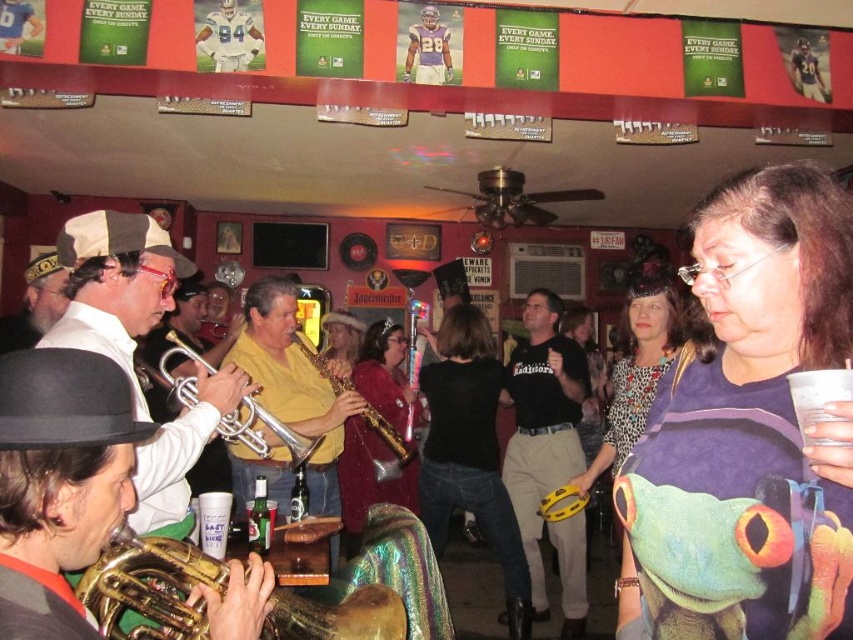
You are a photographer standing at the back of the room. You want to take a photo of the matte gold trumpet at left and the matte yellow shirt at center so that both are in focus. Given that your camera has a depth of field that can cover objects within a 3 meter range, will both subjects be in focus?

The matte gold trumpet at left is 3.52 meters away from the matte yellow shirt at center. Since the distance between them exceeds the camera sensor depth of field range of 3 meters, it is unlikely both will be in focus in a single shot.

You are a photographer trying to capture a clear shot of the purple printed shirt at center and the silver metallic trumpet at center. Since you want both to be in focus, you need to know which object is narrower. Which one is thinner?

The purple printed shirt at center is thinner than the silver metallic trumpet at center, so you should focus on the purple printed shirt at center first as it is narrower.

You are a photographer standing at the entrance of the bar. You want to take a photo of the purple printed shirt at center and ensure that the distance between the shirt and the nearest person is at least 1 meter for a clear shot. Is the current distance sufficient?

The purple printed shirt at center is 79.64 centimeters away from the nearest person, which is less than 1 meter. Therefore, the distance is insufficient for a clear shot without adjusting the position.